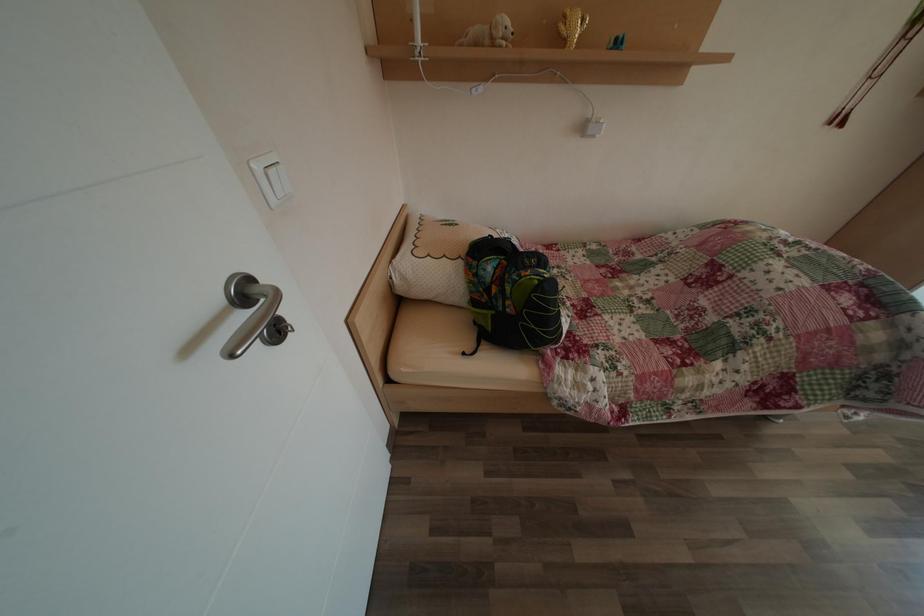
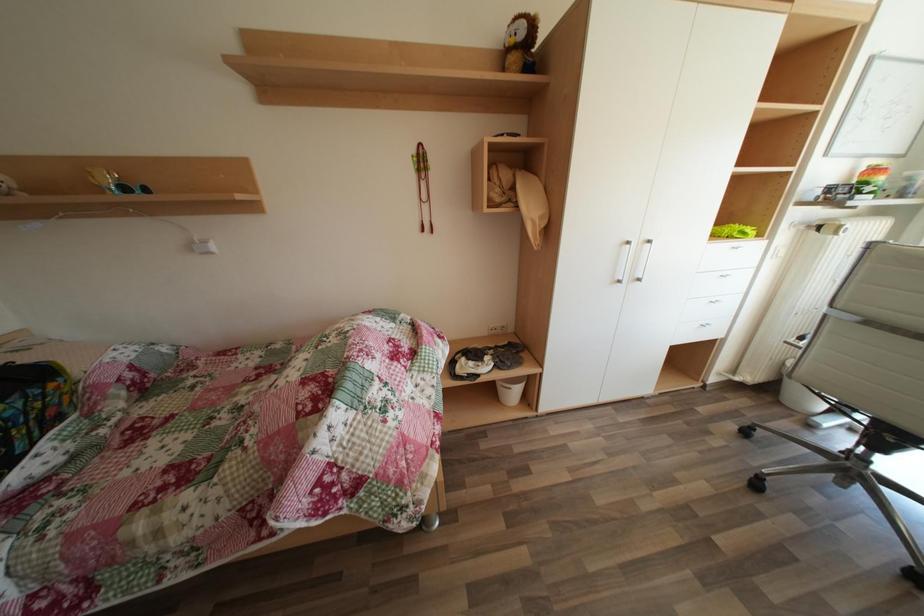
Question: In a continuous first-person perspective shot, in which direction is the camera moving?

Choices:
 (A) Left
 (B) Right
 (C) Forward
 (D) Backward

Answer: (B)